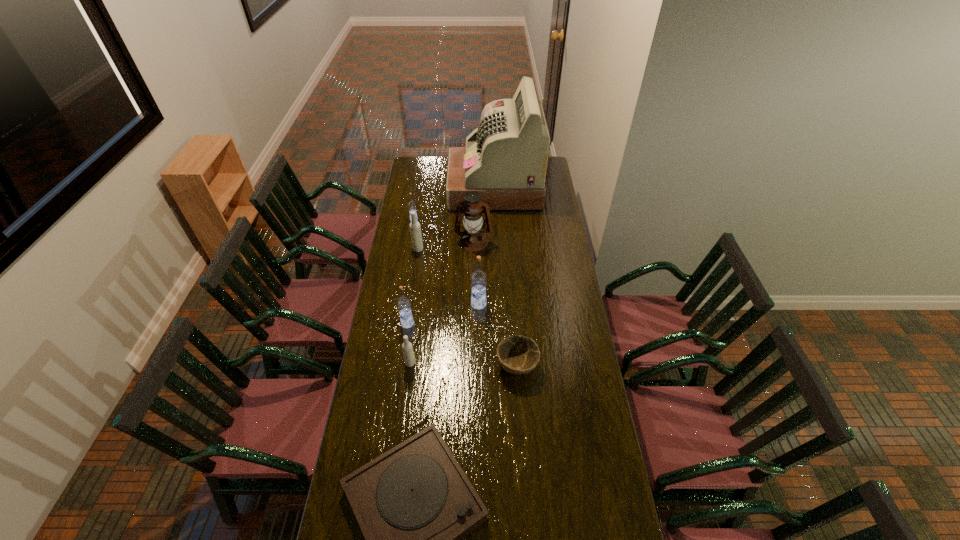
You are a GUI agent. You are given a task and a screenshot of the screen. Output one action in this format:
    pyautogui.click(x=<x>, y=<y>)
    Task: Click on the vacant position located on the front of the nearest blue vodka
    The width and height of the screenshot is (960, 540).
    Given the screenshot: What is the action you would take?
    pyautogui.click(x=402, y=364)

I want to click on vacant space positioned 0.270m on the right of the nearest vodka, so click(481, 363).

The width and height of the screenshot is (960, 540). What are the coordinates of `vacant space situated on the front of the smallest blue vodka` in the screenshot? It's located at (x=409, y=253).

Where is `free space located on the front of the bowl`? The height and width of the screenshot is (540, 960). free space located on the front of the bowl is located at coordinates (522, 442).

Image resolution: width=960 pixels, height=540 pixels. In order to click on object that is at the far edge in this screenshot , I will do `click(505, 158)`.

This screenshot has width=960, height=540. In order to click on object that is at the right edge in this screenshot , I will do `click(505, 158)`.

Locate an element on the screen. The height and width of the screenshot is (540, 960). object at the far right corner is located at coordinates (505, 158).

Identify the location of free space at the far edge of the desktop. Image resolution: width=960 pixels, height=540 pixels. (439, 165).

Where is `free space at the left edge of the desktop`? The width and height of the screenshot is (960, 540). free space at the left edge of the desktop is located at coordinates (412, 254).

This screenshot has width=960, height=540. Find the location of `vacant region at the right edge of the desktop`. vacant region at the right edge of the desktop is located at coordinates (570, 268).